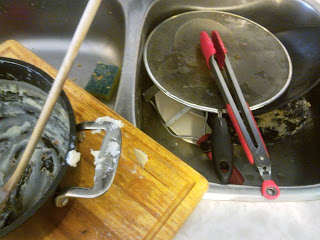
Where is `groove in wodden cutting board`? The image size is (320, 240). groove in wodden cutting board is located at coordinates (177, 170).